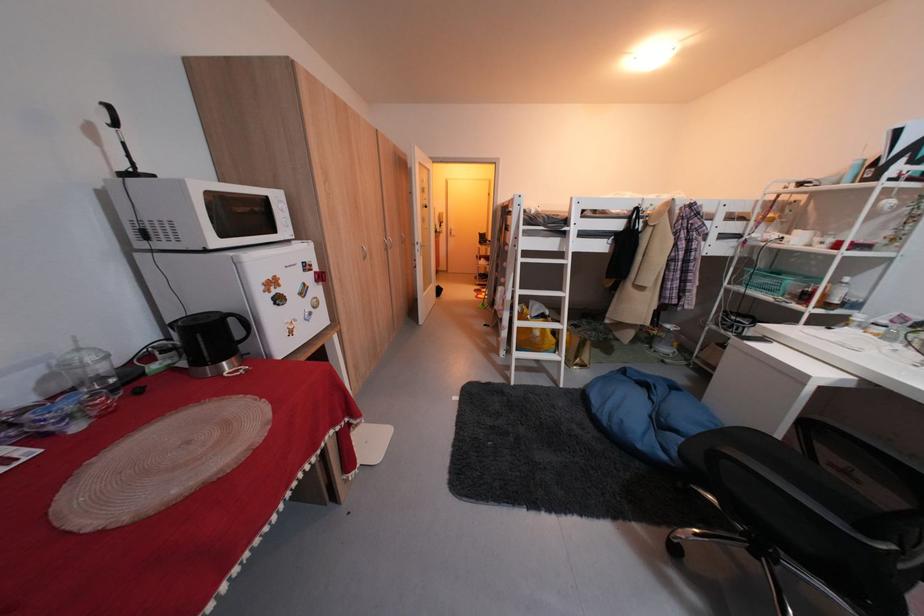
Find where to sit the chair sitting surface. Please return your answer as a coordinate pair (x, y).

(791, 477)